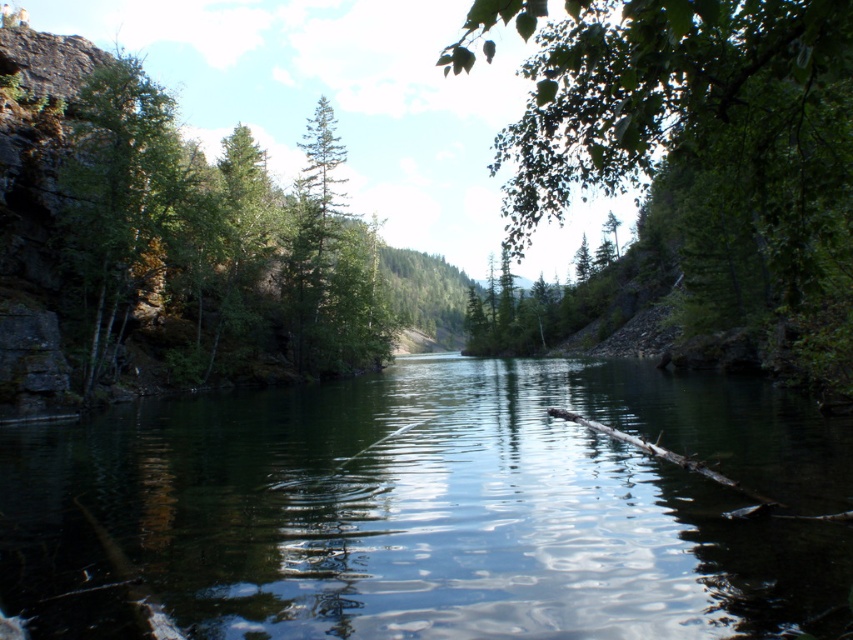
Is green reflective water at center shorter than green leafy tree at center?

Yes, green reflective water at center is shorter than green leafy tree at center.

What are the coordinates of `green reflective water at center` in the screenshot? It's located at (432, 508).

Which is behind, point (45, 563) or point (785, 348)?

The point (785, 348) is behind.

Where is `green reflective water at center`? Image resolution: width=853 pixels, height=640 pixels. green reflective water at center is located at coordinates (432, 508).

Between green reflective water at center and green leafy tree at left, which one is positioned lower?

Positioned lower is green reflective water at center.

Between point (20, 502) and point (108, 259), which one is positioned in front?

Point (20, 502) is more forward.

Is point (564, 589) farther from camera compared to point (107, 118)?

No.

This screenshot has height=640, width=853. I want to click on green reflective water at center, so pos(432,508).

Looking at this image, which is above, green reflective water at center or green matte tree at upper left?

green matte tree at upper left is higher up.

Is point (252, 506) positioned after point (93, 275)?

No, it is not.

Does point (759, 412) lie in front of point (368, 240)?

Yes, it is in front of point (368, 240).

Locate an element on the screen. This screenshot has height=640, width=853. green reflective water at center is located at coordinates (432, 508).